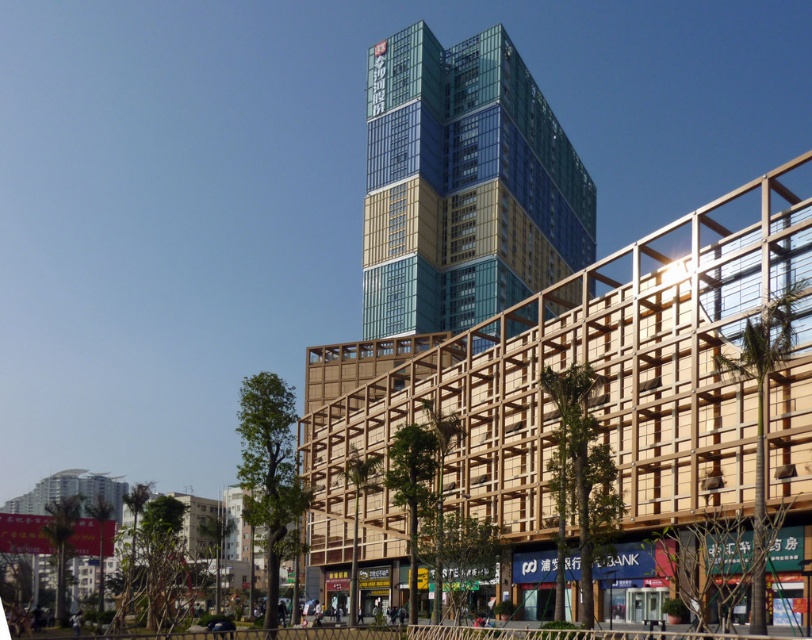
You are a city planner who needs to install a new 100 foot long walkway between the wooden lattice structure at center and the blue glass building at center. Based on the provided image, will the walkway fit between them without needing to be shortened?

The distance between the wooden lattice structure at center and the blue glass building at center is 100.67 feet. Since the walkway is 100 feet long, it will fit with approximately 0.67 feet of extra space remaining.

You are an architect evaluating the urban layout of the scene. You need to determine the spatial relationship between the wooden lattice structure at center and the blue glass building at center. Which structure is located to the right of the other?

The wooden lattice structure at center is positioned on the right side of the blue glass building at center, so the wooden lattice structure at center is to the right of the blue glass building at center.